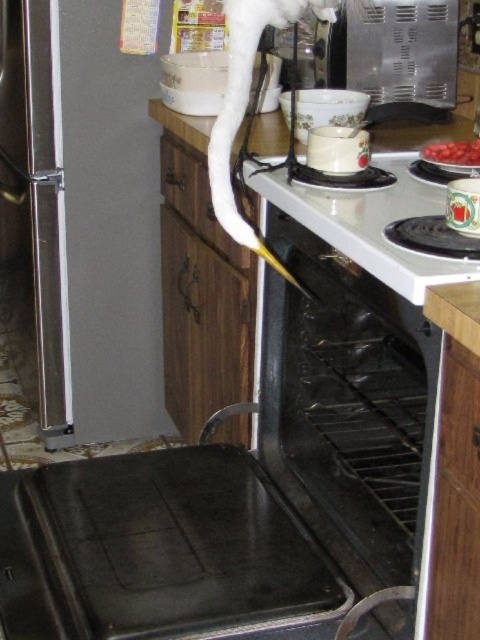
Which of these two, white glossy stove at center or smooth red tomatoes at upper right, stands shorter?

smooth red tomatoes at upper right

Between point (408, 284) and point (423, 156), which one is positioned behind?

The point (423, 156) is behind.

The height and width of the screenshot is (640, 480). Identify the location of white glossy stove at center. (371, 225).